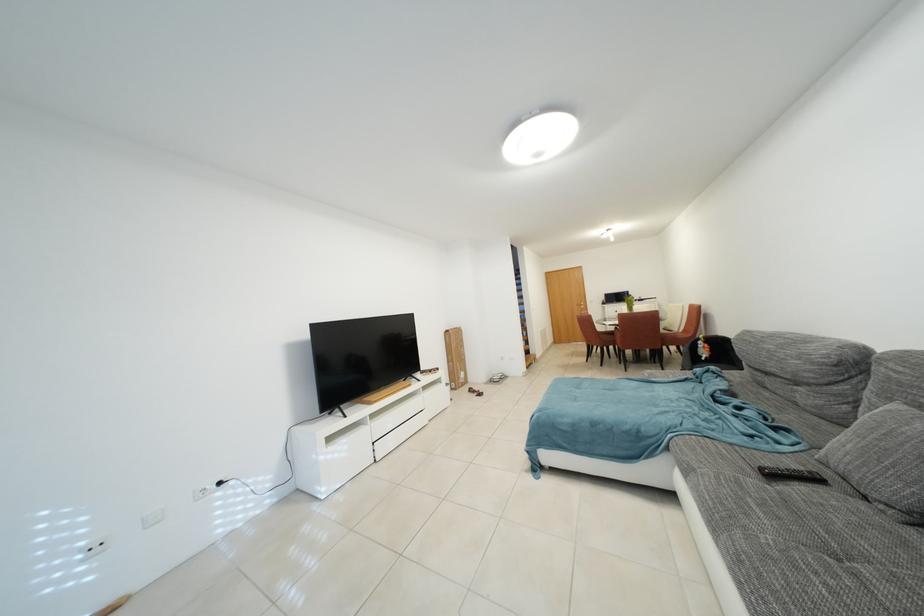
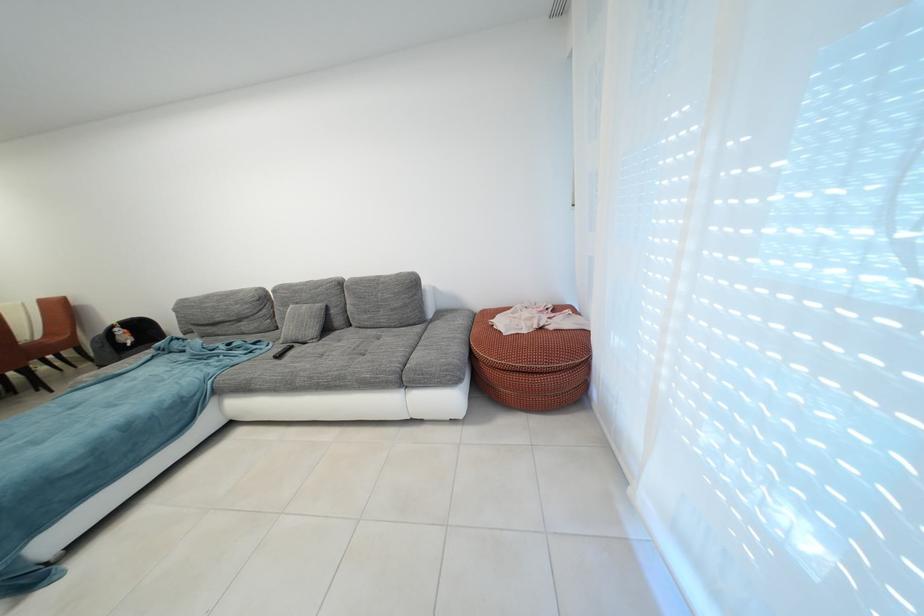
The point at [690,334] is marked in the first image. Where is the corresponding point in the second image?

(45, 341)